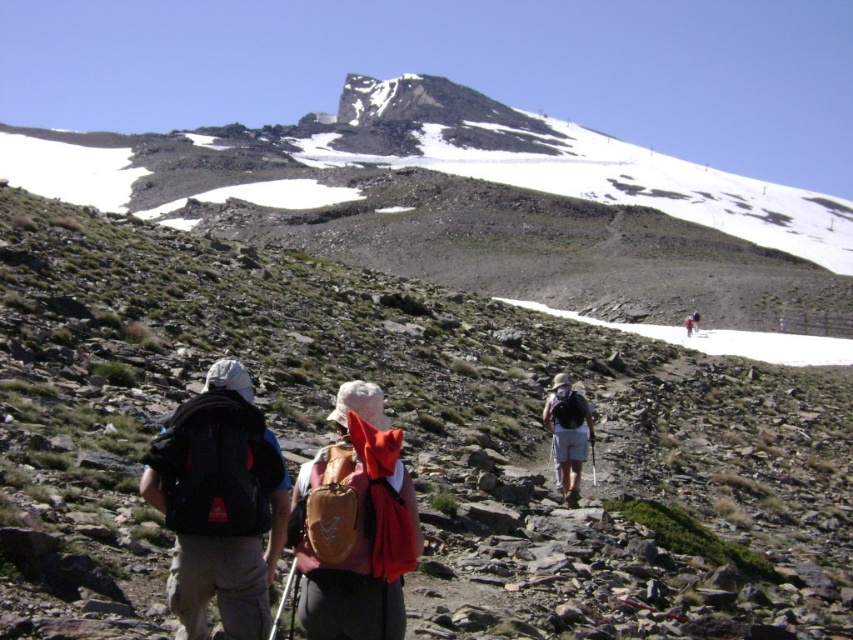
Based on the photo, you are a hiker trying to navigate the rocky mountain trail. You see two points marked on the trail ahead. The first point is at coordinate point [821,236] and the second is at point [358,572]. Which point is closer to your current position?

Point [358,572] is closer to your current position because it is less further to the camera than point [821,236].

You are a hiker planning to move from the starting point to the destination on the mountain trail. The starting point is at point (686, 184) and the destination is at point (573, 465). Based on the scene description, which direction should you head to reach your destination?

Since point (686, 184) is behind point (573, 465), you should move forward towards the destination at point (573, 465) from your current position at point (686, 184).